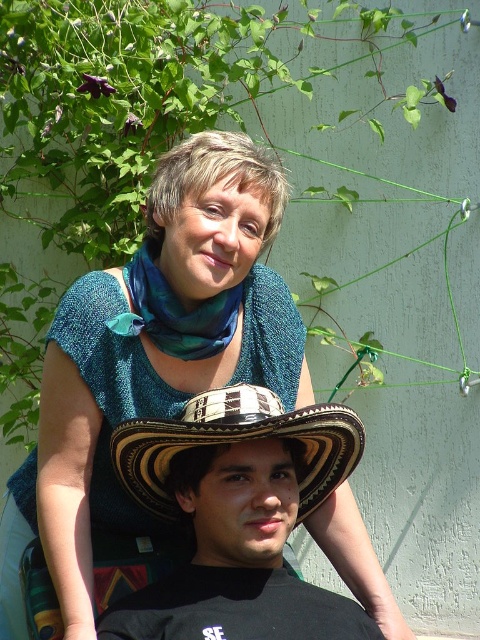
What do you see at coordinates (154, 353) in the screenshot? The height and width of the screenshot is (640, 480). I see `teal textured sweater at upper center` at bounding box center [154, 353].

Does teal textured sweater at upper center lie in front of brown woven hat at lower center?

No, it is behind brown woven hat at lower center.

Between point (93, 397) and point (252, 445), which one is positioned in front?

Positioned in front is point (252, 445).

At what (x,y) coordinates should I click in order to perform the action: click on teal textured sweater at upper center. Please return your answer as a coordinate pair (x, y). Looking at the image, I should click on (154, 353).

Is point (175, 433) less distant than point (310, 460)?

Yes, it is in front of point (310, 460).

This screenshot has width=480, height=640. I want to click on brown woven hat at lower center, so [238, 516].

Based on the photo, does teal textured sweater at upper center appear on the right side of brown woven straw cowboy hat at center?

In fact, teal textured sweater at upper center is to the left of brown woven straw cowboy hat at center.

Does teal textured sweater at upper center appear over brown woven straw cowboy hat at center?

Yes, teal textured sweater at upper center is above brown woven straw cowboy hat at center.

Locate an element on the screen. This screenshot has width=480, height=640. teal textured sweater at upper center is located at coordinates (154, 353).